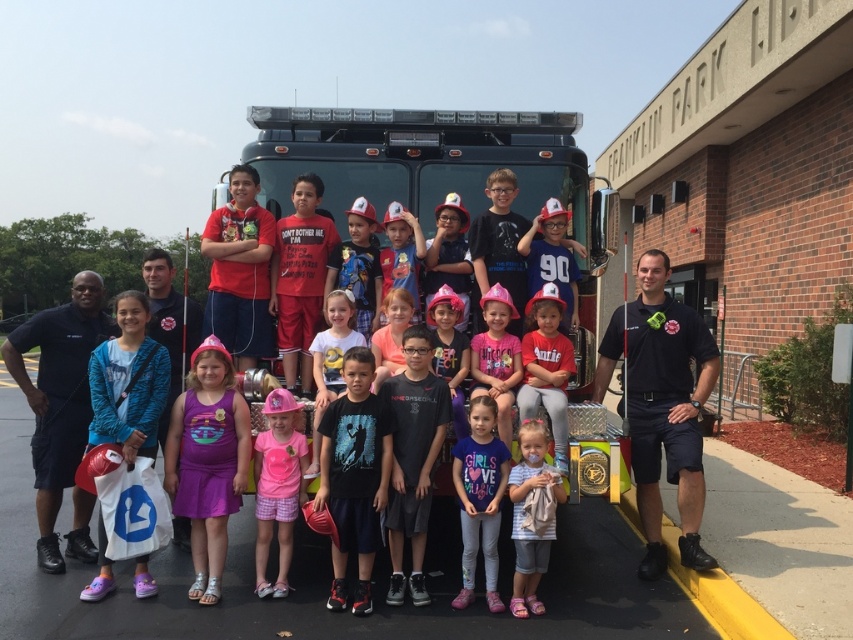
This screenshot has height=640, width=853. Find the location of `pink matte fire helmet at center`. pink matte fire helmet at center is located at coordinates (496, 356).

Image resolution: width=853 pixels, height=640 pixels. I want to click on pink matte fire helmet at center, so click(x=496, y=356).

Between pink fabric shirt at center and white cotton shirt at center, which one is positioned lower?

Positioned lower is white cotton shirt at center.

Is pink fabric shirt at center closer to camera compared to white cotton shirt at center?

No, it is not.

This screenshot has height=640, width=853. What do you see at coordinates (479, 499) in the screenshot? I see `pink fabric shirt at center` at bounding box center [479, 499].

Locate an element on the screen. pink fabric shirt at center is located at coordinates (479, 499).

Between pink matte shirt at center and pink matte fire helmet at center, which one is positioned higher?

Positioned higher is pink matte fire helmet at center.

Looking at this image, which of these two, pink matte shirt at center or pink matte fire helmet at center, stands shorter?

pink matte fire helmet at center

Describe the element at coordinates (277, 486) in the screenshot. This screenshot has height=640, width=853. I see `pink matte shirt at center` at that location.

Where is `pink matte shirt at center`? This screenshot has height=640, width=853. pink matte shirt at center is located at coordinates (277, 486).